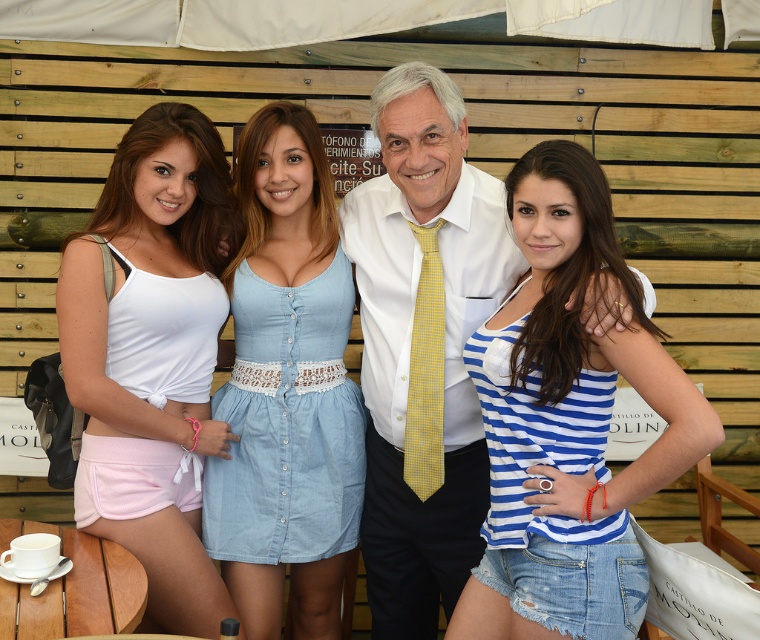
You are a photographer at the event and need to adjust the lighting. The blue striped tank top at center and white smooth shirt at center are both in the frame. Which clothing item is shorter in height?

The blue striped tank top at center has a lesser height compared to the white smooth shirt at center, so the blue striped tank top at center is shorter in height.

Consider the image. You are a photographer trying to capture a group photo of the blue striped tank top at center and the white smooth shirt at center. Which one is on the left side when facing the camera?

The white smooth shirt at center is on the left side because the blue striped tank top at center is positioned on the right side of it.